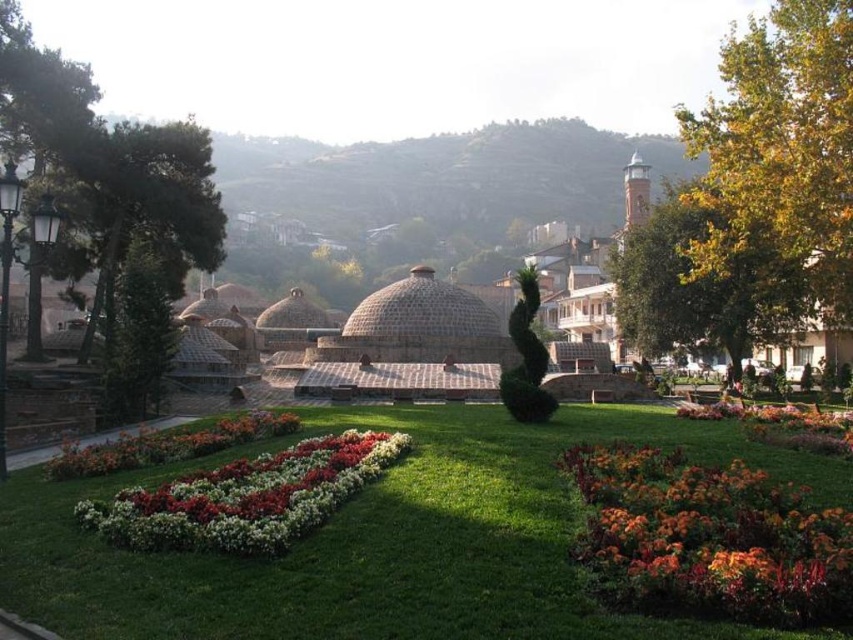
Between point (221, 492) and point (277, 428), which one is positioned in front?

Point (221, 492) is more forward.

Between multicolored floral bed at center and multicolored fabric flower bed at lower center, which one appears on the right side from the viewer's perspective?

multicolored floral bed at center

Where is `multicolored floral bed at center`? multicolored floral bed at center is located at coordinates (247, 497).

Which is more to the right, green grass at center or orange textured flowers at lower right?

orange textured flowers at lower right

Between green grass at center and orange textured flowers at lower right, which one is positioned lower?

green grass at center is lower down.

Image resolution: width=853 pixels, height=640 pixels. What do you see at coordinates (383, 540) in the screenshot? I see `green grass at center` at bounding box center [383, 540].

This screenshot has width=853, height=640. I want to click on green grass at center, so click(383, 540).

Does multicolored floral bed at center lie behind multicolored fabric flower at lower right?

No, multicolored floral bed at center is closer to the viewer.

Which is in front, point (178, 486) or point (846, 432)?

Positioned in front is point (178, 486).

Which is in front, point (158, 496) or point (776, 433)?

Point (158, 496) is in front.

Locate an element on the screen. Image resolution: width=853 pixels, height=640 pixels. multicolored floral bed at center is located at coordinates (247, 497).